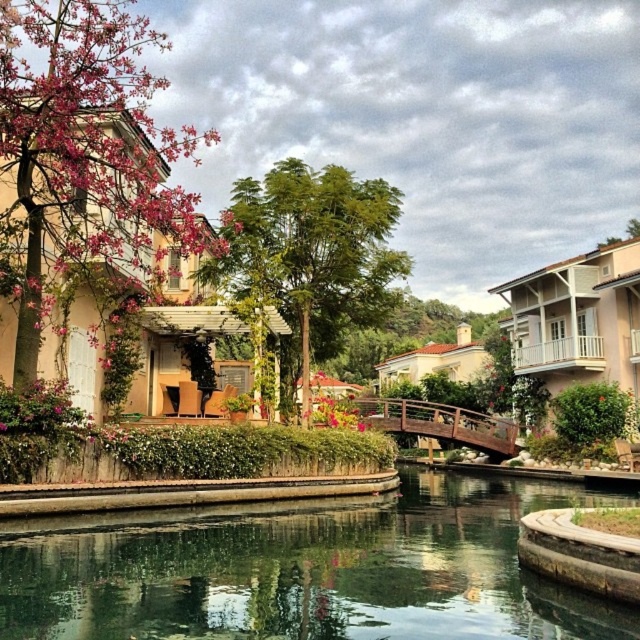
You are a painter planning to sketch the canal scene. You want to ensure the pink blossoms at left and the green leafy tree at center are proportionally accurate. Which of these two objects should you depict as wider in your sketch?

The pink blossoms at left should be depicted as wider in your sketch since their width is larger than that of the green leafy tree at center according to the description.

You are a tourist standing at the edge of the canal and want to take a photo of both the clear glass water at center and the green leafy tree at center. Based on their positions, will the tree appear behind the water in the photo?

Yes, the clear glass water at center is in front of the green leafy tree at center, so the tree will appear behind the water in the photo.

You are a painter standing at the edge of the canal. You want to paint the clear glass water at center and the pink blossoms at left. Which object appears narrower in your painting?

The clear glass water at center appears narrower in the painting because it is thinner than the pink blossoms at left.